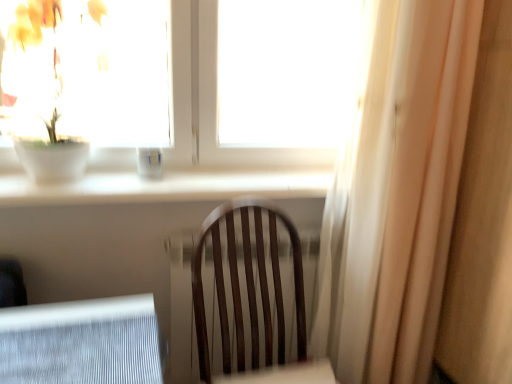
Question: From the image's perspective, is white sheer curtain at right located beneath green matte plant at upper left?

Choices:
 (A) no
 (B) yes

Answer: (B)

Question: Can you confirm if white sheer curtain at right is shorter than green matte plant at upper left?

Choices:
 (A) yes
 (B) no

Answer: (B)

Question: Is white sheer curtain at right located outside green matte plant at upper left?

Choices:
 (A) yes
 (B) no

Answer: (A)

Question: Does white sheer curtain at right have a smaller size compared to green matte plant at upper left?

Choices:
 (A) no
 (B) yes

Answer: (A)

Question: Is white sheer curtain at right oriented towards green matte plant at upper left?

Choices:
 (A) no
 (B) yes

Answer: (A)

Question: Is green matte plant at upper left taller or shorter than white sheer curtain at right?

Choices:
 (A) tall
 (B) short

Answer: (B)

Question: Choose the correct answer: Is green matte plant at upper left inside white sheer curtain at right or outside it?

Choices:
 (A) inside
 (B) outside

Answer: (B)

Question: In the image, is green matte plant at upper left on the left side or the right side of white sheer curtain at right?

Choices:
 (A) left
 (B) right

Answer: (A)

Question: Is green matte plant at upper left wider or thinner than white sheer curtain at right?

Choices:
 (A) thin
 (B) wide

Answer: (A)

Question: In terms of size, does white sheer curtain at right appear bigger or smaller than transparent glass window at upper center?

Choices:
 (A) big
 (B) small

Answer: (A)

Question: Is white sheer curtain at right in front of or behind transparent glass window at upper center in the image?

Choices:
 (A) front
 (B) behind

Answer: (A)

Question: From the image's perspective, is white sheer curtain at right above or below transparent glass window at upper center?

Choices:
 (A) below
 (B) above

Answer: (A)

Question: In the image, is white sheer curtain at right on the left side or the right side of transparent glass window at upper center?

Choices:
 (A) right
 (B) left

Answer: (A)

Question: Visually, is transparent glass window at upper center positioned to the left or to the right of white sheer curtain at right?

Choices:
 (A) left
 (B) right

Answer: (A)

Question: Is transparent glass window at upper center inside the boundaries of white sheer curtain at right, or outside?

Choices:
 (A) inside
 (B) outside

Answer: (B)